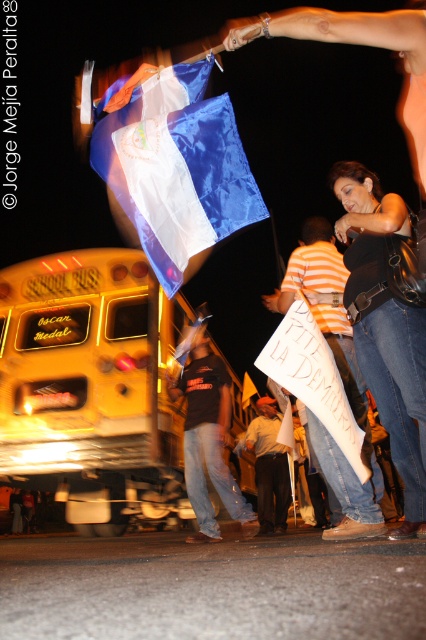
You are organizing a school event and need to place a 3D model of the white paper sign at center in front of the yellow matte school bus at lower left for a display. Given that the bus is much larger, will the sign need to be scaled up to appear proportional in the model?

The yellow matte school bus at lower left is bigger than the white paper sign at center, so the sign does not need to be scaled up because the bus is already larger in size.

You are standing at the back of the yellow school bus and want to hand a document to the person wearing denim jeans at center. However, there is a shiny blue and white flag at upper center in the way. Can you reach the person without moving the flag?

The shiny blue and white flag at upper center is positioned over denim jeans at center, so the flag is blocking the path to the person. You would need to move the flag to reach the person.

You are standing in front of the yellow school bus and want to locate the white paper sign at lower center. According to the scene description, where should you look to find it?

You should look at point (334, 440) to find the white paper sign at lower center.